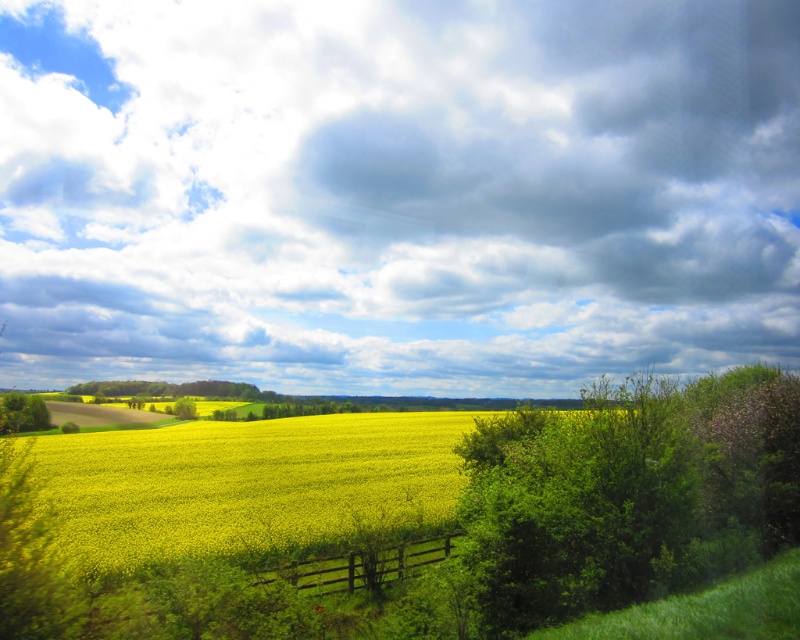
Question: Which of the following is the farthest from the observer?

Choices:
 (A) (186, 403)
 (B) (364, 556)

Answer: (A)

Question: Which object is closer to the camera taking this photo?

Choices:
 (A) green leafy tree at lower left
 (B) green leafy tree at center

Answer: (A)

Question: Which of these objects is positioned closest to the cloudy sky at upper center?

Choices:
 (A) brown wooden fence at center
 (B) yellow matte field at center
 (C) green leafy tree at lower left

Answer: (B)

Question: Can you confirm if yellow matte field at center is smaller than green leafy tree at center?

Choices:
 (A) yes
 (B) no

Answer: (B)

Question: Can you confirm if yellow matte field at center is smaller than brown wooden fence at center?

Choices:
 (A) no
 (B) yes

Answer: (A)

Question: Is green leafy bush at right below brown wooden fence at center?

Choices:
 (A) yes
 (B) no

Answer: (B)